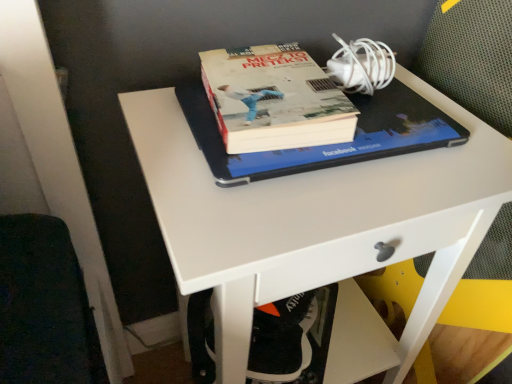
What are the coordinates of `free location in front of hardcover book at center` in the screenshot? It's located at (310, 210).